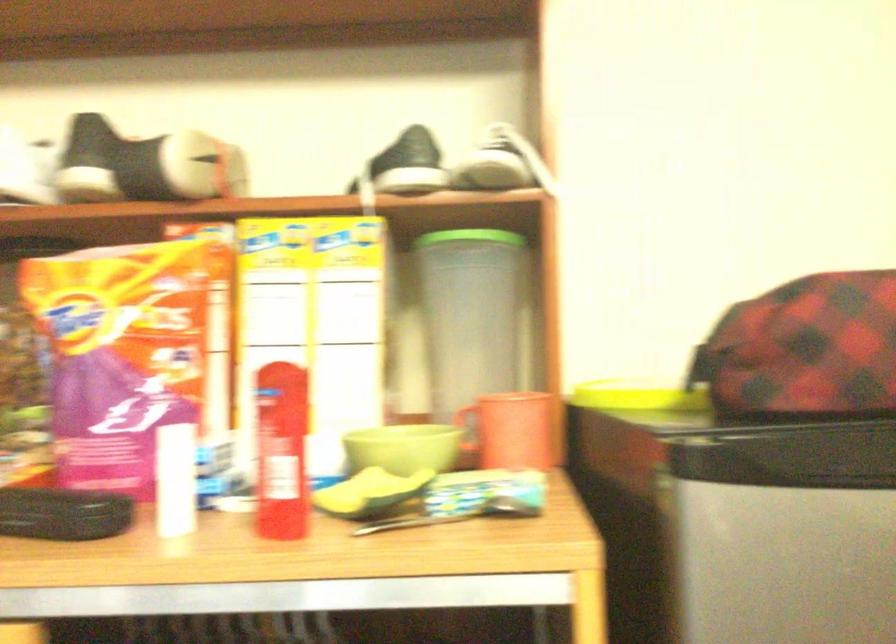
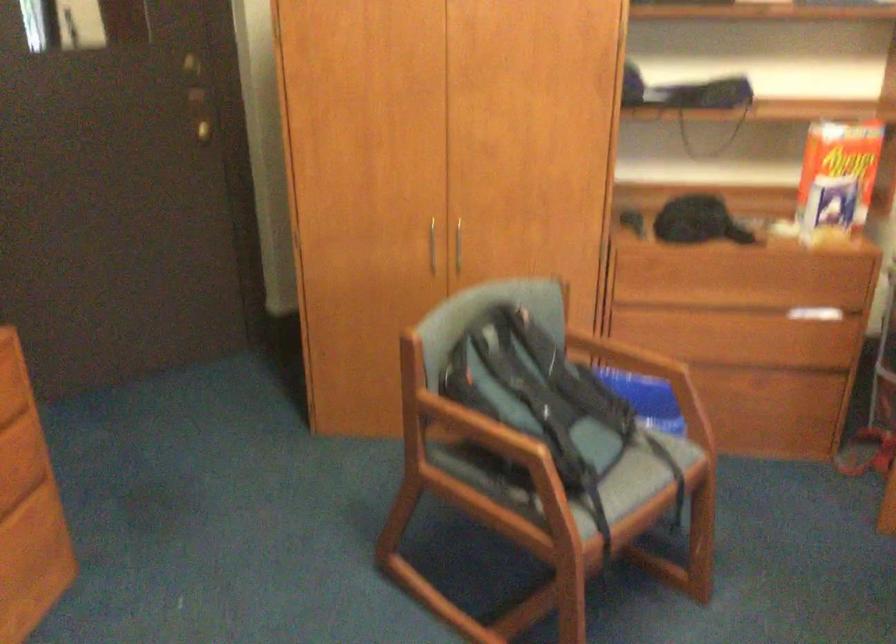
Based on the continuous images, in which direction is the camera rotating?

The camera's rotation is toward right-down.